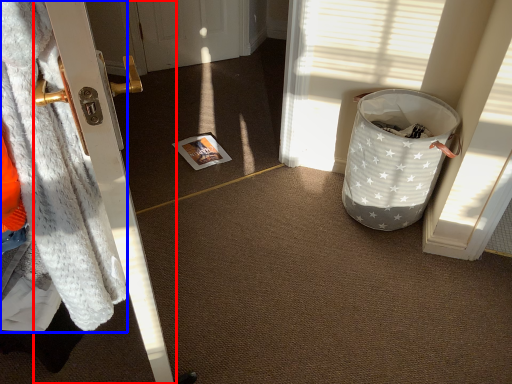
Question: Which of the following is the closest to the observer, door (highlighted by a red box) or blanket (highlighted by a blue box)?

Choices:
 (A) door
 (B) blanket

Answer: (B)